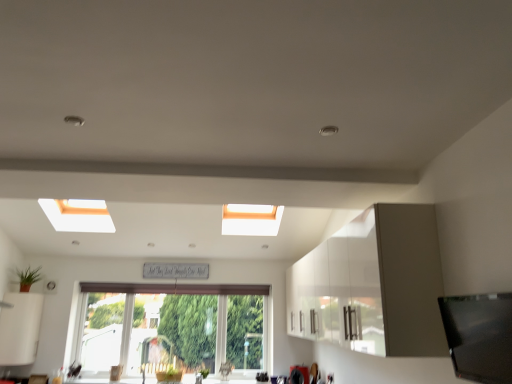
The height and width of the screenshot is (384, 512). Describe the element at coordinates (204, 373) in the screenshot. I see `green leafy plant at lower center, which is counted as the 1th plant, starting from the right` at that location.

Measure the distance between point (123,295) and camera.

Point (123,295) is 5.66 meters away from camera.

In order to click on white glossy cabinet at upper right, which is the 1th cabinetry in right-to-left order in this screenshot , I will do `click(374, 285)`.

The height and width of the screenshot is (384, 512). I want to click on green leafy plant at lower center, which ranks as the 1th plant in bottom-to-top order, so pos(204,373).

From the image's perspective, is white glossy cabinet at upper right, which appears as the 2th cabinetry when viewed from the left, above or below white matte cabinet at lower left, which is counted as the second cabinetry, starting from the right?

white glossy cabinet at upper right, which appears as the 2th cabinetry when viewed from the left, is situated higher than white matte cabinet at lower left, which is counted as the second cabinetry, starting from the right, in the image.

Which of these two, white glossy cabinet at upper right, which appears as the 2th cabinetry when viewed from the left, or white matte cabinet at lower left, the 1th cabinetry viewed from the left, stands taller?

With more height is white glossy cabinet at upper right, which appears as the 2th cabinetry when viewed from the left.

Can you see white glossy cabinet at upper right, which is the 1th cabinetry in right-to-left order, touching white matte cabinet at lower left, which is counted as the second cabinetry, starting from the right?

No, white glossy cabinet at upper right, which is the 1th cabinetry in right-to-left order, is not beside white matte cabinet at lower left, which is counted as the second cabinetry, starting from the right.

Which object is positioned more to the right, white glossy cabinet at upper right, which appears as the 2th cabinetry when viewed from the left, or white matte cabinet at lower left, the 1th cabinetry viewed from the left?

From the viewer's perspective, white glossy cabinet at upper right, which appears as the 2th cabinetry when viewed from the left, appears more on the right side.

Is green leafy plant at lower center, which is counted as the 1th plant, starting from the right, to the left of clear glass window at center from the viewer's perspective?

Incorrect, green leafy plant at lower center, which is counted as the 1th plant, starting from the right, is not on the left side of clear glass window at center.

The image size is (512, 384). Find the location of `window located above the green leafy plant at lower center, the 2th plant when ordered from top to bottom (from a real-world perspective)`. window located above the green leafy plant at lower center, the 2th plant when ordered from top to bottom (from a real-world perspective) is located at coordinates (172, 327).

How many degrees apart are the facing directions of green leafy plant at lower center, which ranks as the 2th plant in left-to-right order, and clear glass window at center?

green leafy plant at lower center, which ranks as the 2th plant in left-to-right order, and clear glass window at center are facing 0.215 degrees away from each other.

Between white matte cabinet at lower left, the 1th cabinetry viewed from the left, and clear glass window at center, which one appears on the right side from the viewer's perspective?

clear glass window at center.

Is white matte cabinet at lower left, which is counted as the second cabinetry, starting from the right, wider or thinner than clear glass window at center?

Considering their sizes, white matte cabinet at lower left, which is counted as the second cabinetry, starting from the right, looks broader than clear glass window at center.

Choose the correct answer: Is white matte cabinet at lower left, the 1th cabinetry viewed from the left, inside clear glass window at center or outside it?

white matte cabinet at lower left, the 1th cabinetry viewed from the left, is spatially situated outside clear glass window at center.

Is clear glass window at center at the back of white matte cabinet at lower left, the 1th cabinetry viewed from the left?

No, white matte cabinet at lower left, the 1th cabinetry viewed from the left, is not facing away from clear glass window at center.

Is point (315, 318) positioned in front of point (22, 279)?

Yes, it is.

Could you tell me if white glossy cabinet at upper right, which is the 1th cabinetry in right-to-left order, is facing green matte plant at lower left, the 1th plant in the left-to-right sequence?

Yes, white glossy cabinet at upper right, which is the 1th cabinetry in right-to-left order, is turned towards green matte plant at lower left, the 1th plant in the left-to-right sequence.

Identify the location of cabinetry that is the 2nd object located in front of the green matte plant at lower left, the 2th plant from the right. The width and height of the screenshot is (512, 384). (374, 285).

Considering the sizes of objects white glossy cabinet at upper right, which appears as the 2th cabinetry when viewed from the left, and green matte plant at lower left, the 2th plant from the right, in the image provided, who is wider, white glossy cabinet at upper right, which appears as the 2th cabinetry when viewed from the left, or green matte plant at lower left, the 2th plant from the right,?

Wider between the two is white glossy cabinet at upper right, which appears as the 2th cabinetry when viewed from the left.

Is clear glass window at center to the right of white matte cabinet at lower left, the 1th cabinetry viewed from the left, from the viewer's perspective?

Yes, clear glass window at center is to the right of white matte cabinet at lower left, the 1th cabinetry viewed from the left.

How different are the orientations of clear glass window at center and white matte cabinet at lower left, the 1th cabinetry viewed from the left, in degrees?

clear glass window at center and white matte cabinet at lower left, the 1th cabinetry viewed from the left, are facing 50.8 degrees away from each other.

Is clear glass window at center in contact with white matte cabinet at lower left, which is counted as the second cabinetry, starting from the right?

No, clear glass window at center is not with white matte cabinet at lower left, which is counted as the second cabinetry, starting from the right.

Which object is further away from the camera, white glossy cabinet at upper right, which is the 1th cabinetry in right-to-left order, or green leafy plant at lower center, which is counted as the 1th plant, starting from the right?

Positioned behind is green leafy plant at lower center, which is counted as the 1th plant, starting from the right.

Who is shorter, white glossy cabinet at upper right, which is the 1th cabinetry in right-to-left order, or green leafy plant at lower center, which ranks as the 1th plant in bottom-to-top order?

green leafy plant at lower center, which ranks as the 1th plant in bottom-to-top order, is shorter.

From the image's perspective, is white glossy cabinet at upper right, which is the 1th cabinetry in right-to-left order, above or below green leafy plant at lower center, which is counted as the 1th plant, starting from the right?

white glossy cabinet at upper right, which is the 1th cabinetry in right-to-left order, is above green leafy plant at lower center, which is counted as the 1th plant, starting from the right.

Is green matte plant at lower left, which is counted as the first plant, starting from the top, positioned beyond the bounds of green leafy plant at lower center, which ranks as the 2th plant in left-to-right order?

green matte plant at lower left, which is counted as the first plant, starting from the top, lies outside green leafy plant at lower center, which ranks as the 2th plant in left-to-right order,'s area.

Is green matte plant at lower left, which is counted as the second plant, starting from the bottom, at the right side of green leafy plant at lower center, which is counted as the 1th plant, starting from the right?

No, green matte plant at lower left, which is counted as the second plant, starting from the bottom, is not to the right of green leafy plant at lower center, which is counted as the 1th plant, starting from the right.

From a real-world perspective, is green matte plant at lower left, the 1th plant in the left-to-right sequence, physically below green leafy plant at lower center, the 2th plant when ordered from top to bottom?

Incorrect, from a real-world perspective, green matte plant at lower left, the 1th plant in the left-to-right sequence, is higher than green leafy plant at lower center, the 2th plant when ordered from top to bottom.

Who is smaller, green matte plant at lower left, the 1th plant in the left-to-right sequence, or green leafy plant at lower center, which ranks as the 2th plant in left-to-right order?

Smaller between the two is green leafy plant at lower center, which ranks as the 2th plant in left-to-right order.

The image size is (512, 384). Find the location of `cabinetry that is under the white glossy cabinet at upper right, which is the 1th cabinetry in right-to-left order (from a real-world perspective)`. cabinetry that is under the white glossy cabinet at upper right, which is the 1th cabinetry in right-to-left order (from a real-world perspective) is located at coordinates (20, 328).

At what (x,y) coordinates should I click in order to perform the action: click on window on the left of green leafy plant at lower center, which ranks as the 1th plant in bottom-to-top order. Please return your answer as a coordinate pair (x, y). The width and height of the screenshot is (512, 384). Looking at the image, I should click on (172, 327).

Estimate the real-world distances between objects in this image. Which object is further from white glossy cabinet at upper right, which appears as the 2th cabinetry when viewed from the left, green matte plant at lower left, the 1th plant in the left-to-right sequence, or green leafy plant at lower center, which is counted as the 1th plant, starting from the right?

green matte plant at lower left, the 1th plant in the left-to-right sequence.

Estimate the real-world distances between objects in this image. Which object is further from green matte plant at lower left, the 1th plant in the left-to-right sequence, white glossy cabinet at upper right, which appears as the 2th cabinetry when viewed from the left, or white matte cabinet at lower left, which is counted as the second cabinetry, starting from the right?

white glossy cabinet at upper right, which appears as the 2th cabinetry when viewed from the left, is further to green matte plant at lower left, the 1th plant in the left-to-right sequence.

Considering their positions, is clear glass window at center positioned further to white matte cabinet at lower left, which is counted as the second cabinetry, starting from the right, than green leafy plant at lower center, which is counted as the 1th plant, starting from the right?

The object further to white matte cabinet at lower left, which is counted as the second cabinetry, starting from the right, is green leafy plant at lower center, which is counted as the 1th plant, starting from the right.

Considering their positions, is white matte cabinet at lower left, which is counted as the second cabinetry, starting from the right, positioned closer to green leafy plant at lower center, the 2th plant when ordered from top to bottom, than green matte plant at lower left, the 2th plant from the right?

Among the two, white matte cabinet at lower left, which is counted as the second cabinetry, starting from the right, is located nearer to green leafy plant at lower center, the 2th plant when ordered from top to bottom.

Looking at the image, which one is located further to green matte plant at lower left, the 1th plant in the left-to-right sequence, white glossy cabinet at upper right, which appears as the 2th cabinetry when viewed from the left, or clear glass window at center?

Based on the image, white glossy cabinet at upper right, which appears as the 2th cabinetry when viewed from the left, appears to be further to green matte plant at lower left, the 1th plant in the left-to-right sequence.

Based on the photo, estimate the real-world distances between objects in this image. Which object is further from green leafy plant at lower center, which is counted as the 1th plant, starting from the right, clear glass window at center or white glossy cabinet at upper right, which appears as the 2th cabinetry when viewed from the left?

white glossy cabinet at upper right, which appears as the 2th cabinetry when viewed from the left, lies further to green leafy plant at lower center, which is counted as the 1th plant, starting from the right, than the other object.

Looking at the image, which one is located closer to white matte cabinet at lower left, the 1th cabinetry viewed from the left, green leafy plant at lower center, which is counted as the 1th plant, starting from the right, or green matte plant at lower left, which is counted as the first plant, starting from the top?

Among the two, green matte plant at lower left, which is counted as the first plant, starting from the top, is located nearer to white matte cabinet at lower left, the 1th cabinetry viewed from the left.

Looking at the image, which one is located further to white matte cabinet at lower left, which is counted as the second cabinetry, starting from the right, white glossy cabinet at upper right, which is the 1th cabinetry in right-to-left order, or clear glass window at center?

white glossy cabinet at upper right, which is the 1th cabinetry in right-to-left order.

At what (x,y) coordinates should I click in order to perform the action: click on plant situated between white matte cabinet at lower left, which is counted as the second cabinetry, starting from the right, and green leafy plant at lower center, which is counted as the 1th plant, starting from the right, from left to right. Please return your answer as a coordinate pair (x, y). Looking at the image, I should click on (28, 278).

I want to click on window between green matte plant at lower left, which is counted as the second plant, starting from the bottom, and green leafy plant at lower center, which ranks as the 2th plant in left-to-right order, from left to right, so click(172, 327).

Locate an element on the screen. This screenshot has width=512, height=384. plant situated between white matte cabinet at lower left, the 1th cabinetry viewed from the left, and clear glass window at center from left to right is located at coordinates (28, 278).

The image size is (512, 384). Identify the location of window between white matte cabinet at lower left, which is counted as the second cabinetry, starting from the right, and green leafy plant at lower center, which ranks as the 2th plant in left-to-right order, in the horizontal direction. (172, 327).